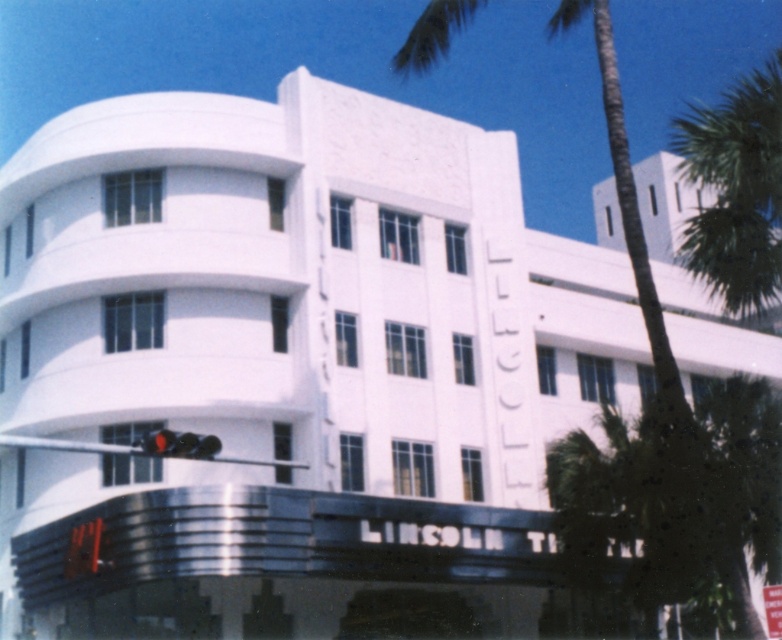
Question: Which object is farther from the camera taking this photo?

Choices:
 (A) matte black traffic light at lower center
 (B) green leafy palm tree at center

Answer: (B)

Question: Estimate the real-world distances between objects in this image. Which object is closer to the green leafy palm tree at center?

Choices:
 (A) white plastic street sign at center
 (B) matte black traffic light at lower center

Answer: (A)

Question: Which of the following is the closest to the observer?

Choices:
 (A) (203, 435)
 (B) (673, 384)
 (C) (766, 616)

Answer: (B)

Question: Is green leafy palm tree at center above white plastic street sign at center?

Choices:
 (A) yes
 (B) no

Answer: (A)

Question: Can you confirm if matte black traffic light at lower center is positioned to the left of white plastic street sign at center?

Choices:
 (A) yes
 (B) no

Answer: (A)

Question: Does green leafy palm tree at center have a greater width compared to white plastic street sign at center?

Choices:
 (A) no
 (B) yes

Answer: (B)